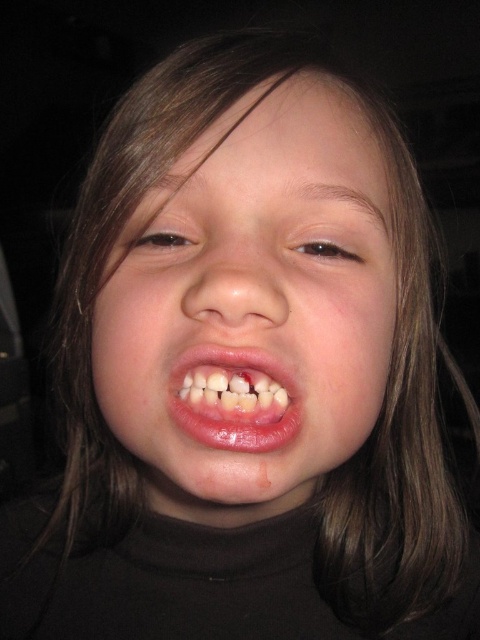
Who is lower down, smooth skin face at center or pink glossy lips at center?

pink glossy lips at center is lower down.

Between point (332, 365) and point (269, 433), which one is positioned in front?

Point (269, 433) is in front.

Where is `smooth skin face at center`? smooth skin face at center is located at coordinates (252, 305).